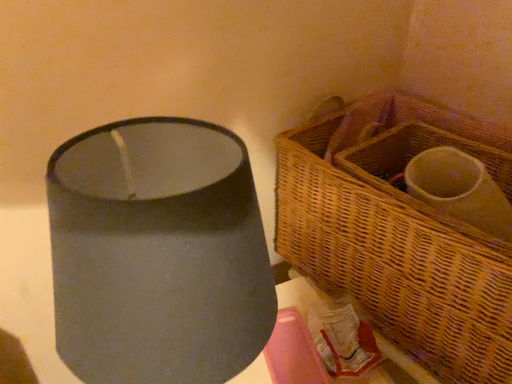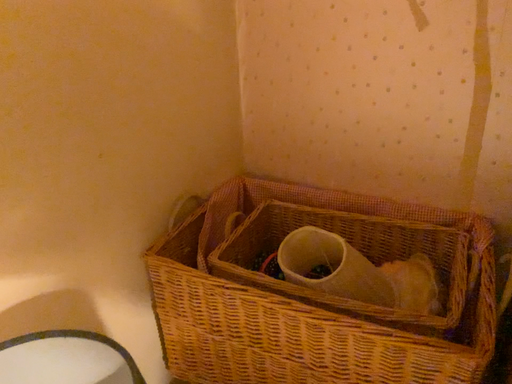
Question: How did the camera likely rotate when shooting the video?

Choices:
 (A) rotated left
 (B) rotated right

Answer: (B)